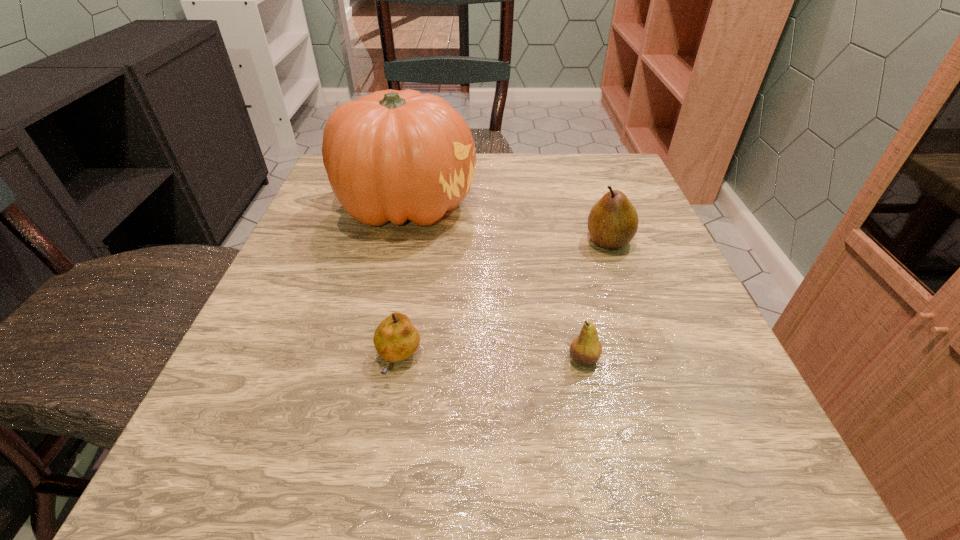
Where is `object that is the closest to the shortest pear`? object that is the closest to the shortest pear is located at coordinates (586, 348).

I want to click on object identified as the closest to the shortest pear, so click(586, 348).

At what (x,y) coordinates should I click in order to perform the action: click on pear identified as the closest to the second tallest object. Please return your answer as a coordinate pair (x, y). Looking at the image, I should click on (586, 348).

You are a GUI agent. You are given a task and a screenshot of the screen. Output one action in this format:
    pyautogui.click(x=<x>, y=<y>)
    Task: Click on the pear that is the second closest to the second object from right to left
    
    Given the screenshot: What is the action you would take?
    pyautogui.click(x=613, y=221)

Where is `free space in the image that satisfies the following two spatial constraints: 1. on the back side of the second tallest object; 2. on the right side of the shortest object`? The height and width of the screenshot is (540, 960). free space in the image that satisfies the following two spatial constraints: 1. on the back side of the second tallest object; 2. on the right side of the shortest object is located at coordinates (419, 241).

Where is `vacant space that satisfies the following two spatial constraints: 1. on the carved face of the second tallest object; 2. on the left side of the tallest object`? The image size is (960, 540). vacant space that satisfies the following two spatial constraints: 1. on the carved face of the second tallest object; 2. on the left side of the tallest object is located at coordinates [398, 241].

The height and width of the screenshot is (540, 960). Find the location of `vacant area that satisfies the following two spatial constraints: 1. on the carved face of the pumpkin; 2. on the right side of the shortest object`. vacant area that satisfies the following two spatial constraints: 1. on the carved face of the pumpkin; 2. on the right side of the shortest object is located at coordinates point(372,360).

The width and height of the screenshot is (960, 540). Identify the location of vacant region that satisfies the following two spatial constraints: 1. on the carved face of the pumpkin; 2. on the left side of the second pear from left to right. (372, 359).

Find the location of `blank space that satisfies the following two spatial constraints: 1. on the carved face of the pumpkin; 2. on the back side of the shortest object`. blank space that satisfies the following two spatial constraints: 1. on the carved face of the pumpkin; 2. on the back side of the shortest object is located at coordinates (372, 360).

The height and width of the screenshot is (540, 960). In order to click on free spot that satisfies the following two spatial constraints: 1. on the carved face of the pumpkin; 2. on the right side of the shortest pear in this screenshot , I will do `click(372, 360)`.